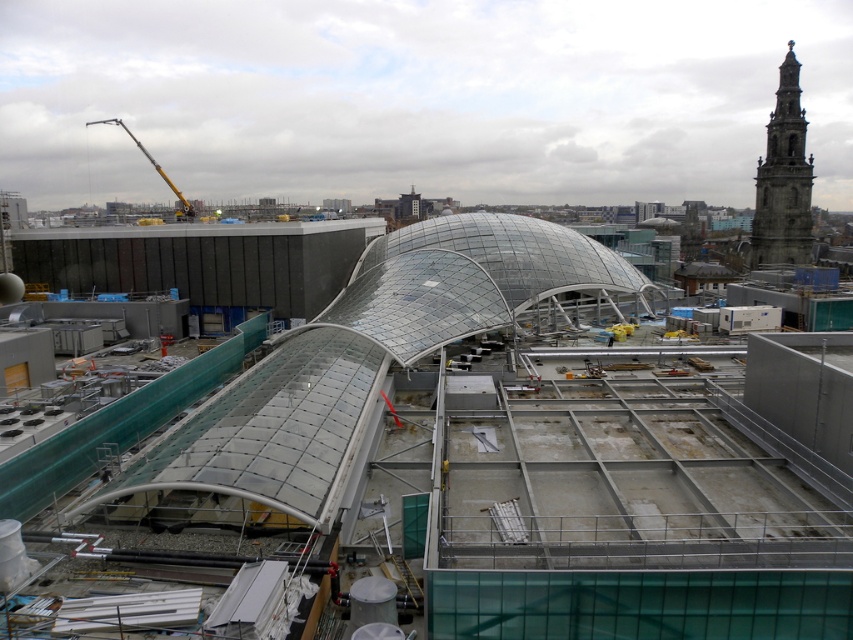
Question: Can you confirm if transparent glass dome at center is thinner than stone tower at upper right?

Choices:
 (A) no
 (B) yes

Answer: (A)

Question: Which of the following is the closest to the observer?

Choices:
 (A) stone tower at upper right
 (B) transparent glass dome at center

Answer: (B)

Question: Can you confirm if transparent glass dome at center is bigger than stone tower at upper right?

Choices:
 (A) no
 (B) yes

Answer: (B)

Question: Which point appears farthest from the camera in this image?

Choices:
 (A) (798, 177)
 (B) (247, 508)

Answer: (A)

Question: Which object appears farthest from the camera in this image?

Choices:
 (A) stone tower at upper right
 (B) transparent glass dome at center

Answer: (A)

Question: Does transparent glass dome at center have a smaller size compared to stone tower at upper right?

Choices:
 (A) no
 (B) yes

Answer: (A)